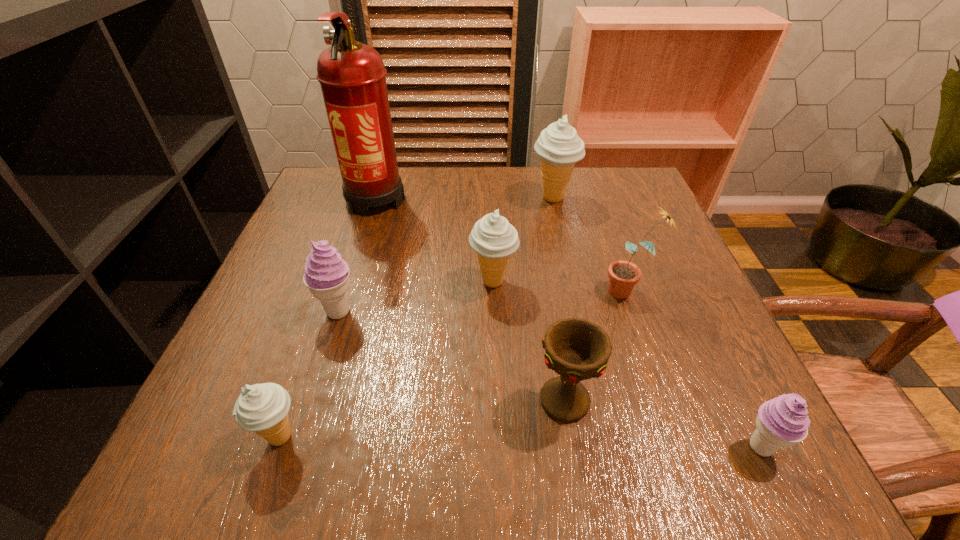
I want to click on vacant space positioned on the right of the left purple icecream, so click(x=472, y=312).

At what (x,y) coordinates should I click in order to perform the action: click on free spot located 0.390m on the back of the red chalice. Please return your answer as a coordinate pair (x, y). Looking at the image, I should click on click(539, 231).

Image resolution: width=960 pixels, height=540 pixels. In order to click on free space located on the right of the smallest beige icecream in this screenshot , I will do `click(454, 436)`.

Where is `vacant point located 0.380m on the left of the right purple icecream`? Image resolution: width=960 pixels, height=540 pixels. vacant point located 0.380m on the left of the right purple icecream is located at coordinates (475, 447).

The image size is (960, 540). I want to click on fire extinguisher that is at the far edge, so pyautogui.click(x=352, y=76).

The height and width of the screenshot is (540, 960). I want to click on icecream present at the far edge, so click(x=559, y=147).

This screenshot has width=960, height=540. I want to click on chalice at the near edge, so click(x=577, y=349).

Where is `fire extinguisher positioned at the left edge`? The width and height of the screenshot is (960, 540). fire extinguisher positioned at the left edge is located at coordinates (352, 76).

Where is `sunflower that is at the right edge`? Image resolution: width=960 pixels, height=540 pixels. sunflower that is at the right edge is located at coordinates (623, 275).

What are the coordinates of `icecream situated at the right edge` in the screenshot? It's located at (781, 422).